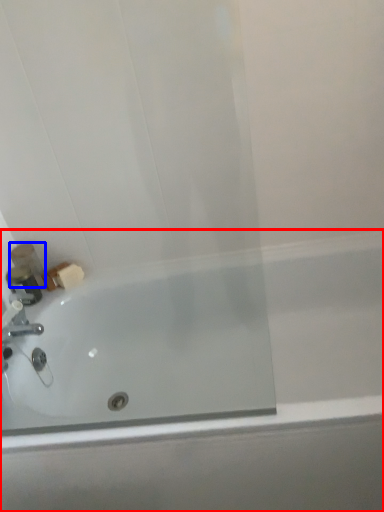
Question: Among these objects, which one is nearest to the camera, bathtub (highlighted by a red box) or toiletry (highlighted by a blue box)?

Choices:
 (A) bathtub
 (B) toiletry

Answer: (A)